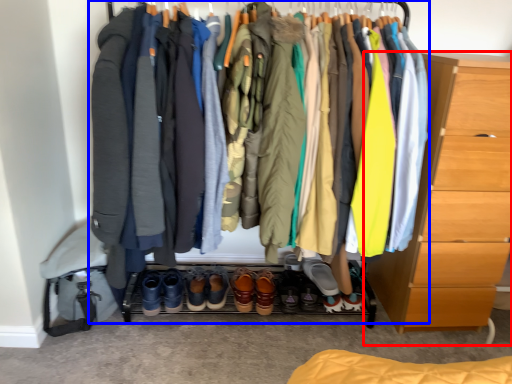
Question: Which of the following is the farthest to the observer, chest of drawers (highlighted by a red box) or closet (highlighted by a blue box)?

Choices:
 (A) chest of drawers
 (B) closet

Answer: (A)